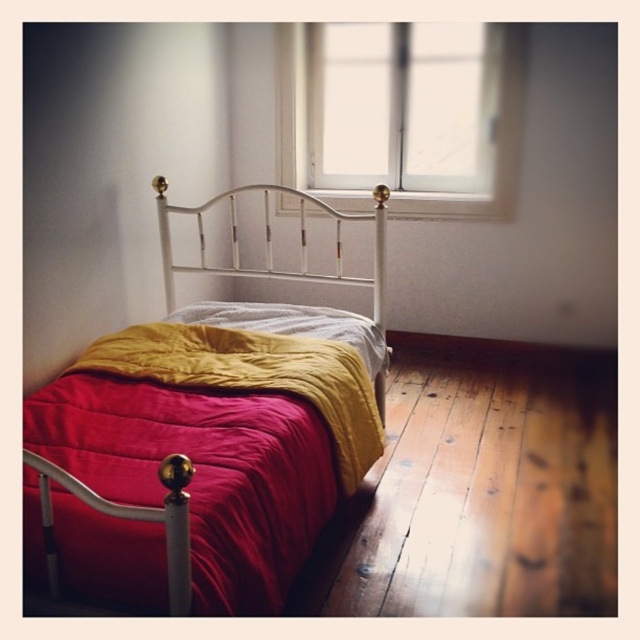
Which of these two, white wooden window at upper center or white metal headboard at center, stands shorter?

white metal headboard at center

Where is `white wooden window at upper center`? This screenshot has width=640, height=640. white wooden window at upper center is located at coordinates (410, 122).

Is matte white metal bed at center smaller than white metal headboard at center?

Actually, matte white metal bed at center might be larger than white metal headboard at center.

Which is behind, point (353, 428) or point (310, 196)?

Positioned behind is point (310, 196).

Locate an element on the screen. This screenshot has width=640, height=640. matte white metal bed at center is located at coordinates (204, 444).

This screenshot has height=640, width=640. I want to click on matte white metal bed at center, so click(204, 444).

Does white wooden window at upper center have a larger size compared to velvet red blanket at center?

Yes.

What are the coordinates of `white wooden window at upper center` in the screenshot? It's located at (410, 122).

Is point (305, 84) positioned after point (131, 378)?

Yes.

I want to click on white wooden window at upper center, so click(x=410, y=122).